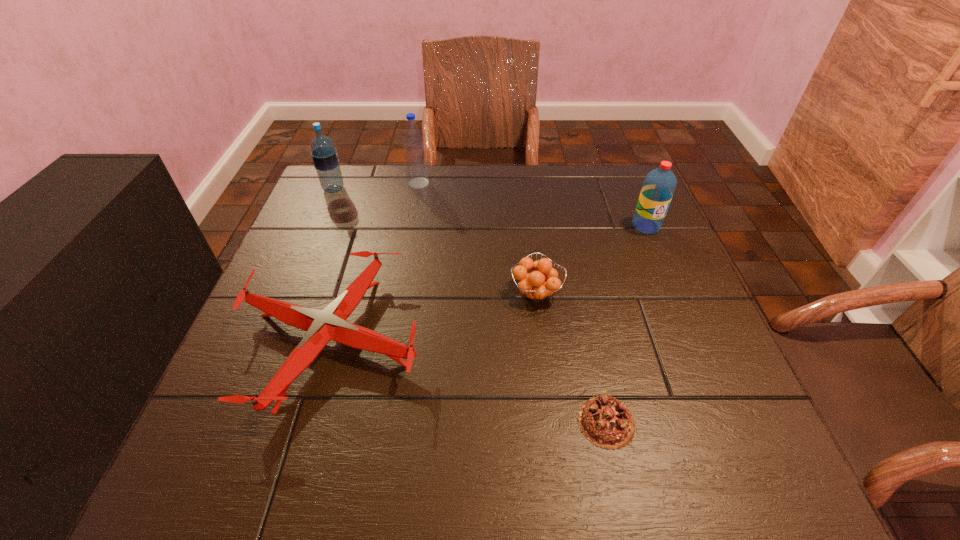
At what (x,y) coordinates should I click in order to perform the action: click on vacant region at the left edge of the desktop. Please return your answer as a coordinate pair (x, y). The image size is (960, 540). Looking at the image, I should click on (287, 356).

The height and width of the screenshot is (540, 960). Find the location of `vacant space at the right edge`. vacant space at the right edge is located at coordinates (613, 244).

Identify the location of vacant region at the far left corner of the desktop. The height and width of the screenshot is (540, 960). (322, 198).

Where is `vacant space at the far right corner of the desktop`? vacant space at the far right corner of the desktop is located at coordinates click(600, 180).

Identify the location of free region at the near right corner. (683, 483).

Find the location of a particular element. vacant region between the leftmost water bottle and the drone is located at coordinates (333, 264).

Find the location of a particular element. The image size is (960, 540). vacant region between the leftmost water bottle and the orange fruit is located at coordinates (435, 241).

Find the location of a particular element. The width and height of the screenshot is (960, 540). vacant area that lies between the second water bottle from left to right and the rightmost object is located at coordinates (532, 205).

Identify the location of free space between the leftmost water bottle and the orange fruit. This screenshot has height=540, width=960. (435, 241).

Image resolution: width=960 pixels, height=540 pixels. What are the coordinates of `vacant space that's between the orange fruit and the leftmost water bottle` in the screenshot? It's located at (435, 241).